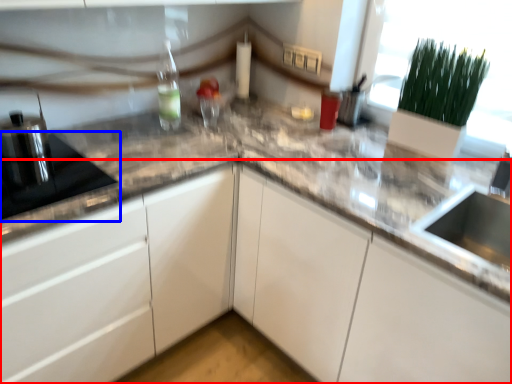
Question: Which point is closer to the camera, cabinetry (highlighted by a red box) or appliance (highlighted by a blue box)?

Choices:
 (A) cabinetry
 (B) appliance

Answer: (A)